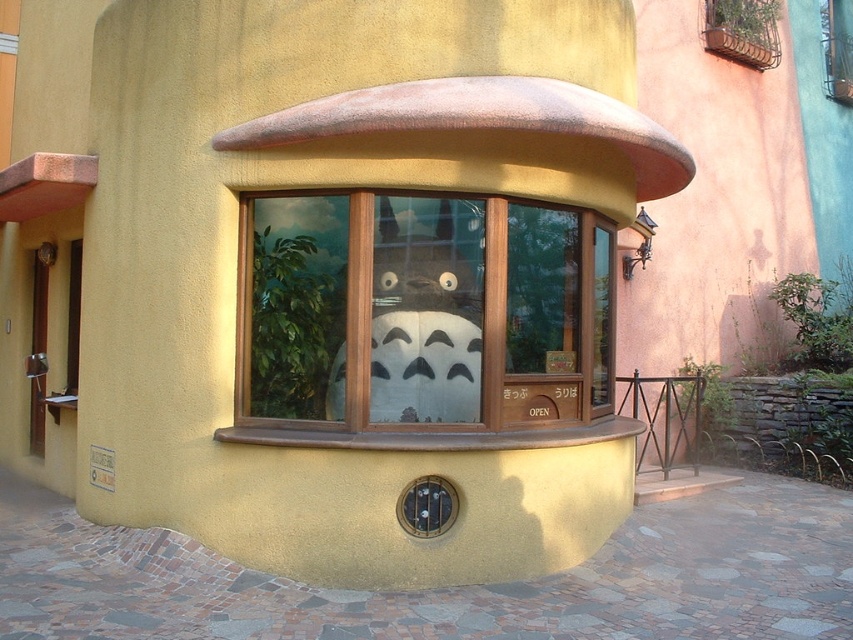
Does wooden bay window at center lie in front of white matte totoro at center?

Yes, wooden bay window at center is in front of white matte totoro at center.

Where is `wooden bay window at center`? The width and height of the screenshot is (853, 640). wooden bay window at center is located at coordinates (418, 314).